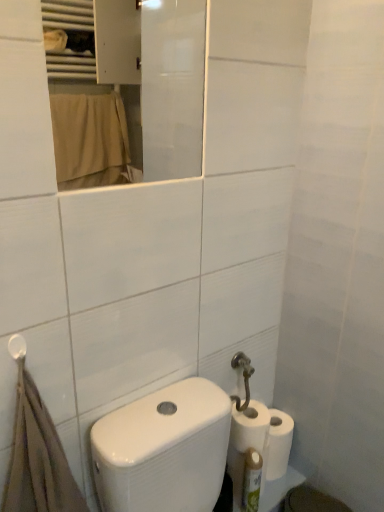
Question: Is white glossy mirror at upper center positioned beyond the bounds of white matte toilet paper at lower right, placed as the third toilet paper when sorted from top to bottom?

Choices:
 (A) no
 (B) yes

Answer: (B)

Question: From the image's perspective, would you say white glossy mirror at upper center is shown under white matte toilet paper at lower right, placed as the 1th toilet paper when sorted from bottom to top?

Choices:
 (A) yes
 (B) no

Answer: (B)

Question: Considering the relative positions of white glossy mirror at upper center and white matte toilet paper at lower right, placed as the 1th toilet paper when sorted from bottom to top, in the image provided, is white glossy mirror at upper center in front of white matte toilet paper at lower right, placed as the 1th toilet paper when sorted from bottom to top,?

Choices:
 (A) yes
 (B) no

Answer: (A)

Question: Is white glossy mirror at upper center wider than white matte toilet paper at lower right, placed as the third toilet paper when sorted from top to bottom?

Choices:
 (A) yes
 (B) no

Answer: (B)

Question: From a real-world perspective, is white glossy mirror at upper center under white matte toilet paper at lower right, placed as the 1th toilet paper when sorted from bottom to top?

Choices:
 (A) yes
 (B) no

Answer: (B)

Question: Does white glossy mirror at upper center have a larger size compared to white matte toilet paper at lower right, placed as the 1th toilet paper when sorted from bottom to top?

Choices:
 (A) yes
 (B) no

Answer: (A)

Question: Is white matte toilet paper at lower right, which is counted as the second toilet paper, starting from the top, aimed at white matte toilet paper at lower right, the third toilet paper when ordered from bottom to top?

Choices:
 (A) yes
 (B) no

Answer: (B)

Question: From the image's perspective, is white matte toilet paper at lower right, the 2th toilet paper positioned from the bottom, over white matte toilet paper at lower right, the third toilet paper when ordered from bottom to top?

Choices:
 (A) no
 (B) yes

Answer: (A)

Question: Is white matte toilet paper at lower right, the 2th toilet paper positioned from the bottom, located outside white matte toilet paper at lower right, which is counted as the first toilet paper, starting from the top?

Choices:
 (A) no
 (B) yes

Answer: (B)

Question: Is white matte toilet paper at lower right, which is counted as the second toilet paper, starting from the top, smaller than white matte toilet paper at lower right, which is counted as the first toilet paper, starting from the top?

Choices:
 (A) yes
 (B) no

Answer: (A)

Question: Is white matte toilet paper at lower right, the 2th toilet paper positioned from the bottom, positioned behind white matte toilet paper at lower right, which is counted as the first toilet paper, starting from the top?

Choices:
 (A) yes
 (B) no

Answer: (A)

Question: Is white matte toilet paper at lower right, which is counted as the second toilet paper, starting from the top, with white matte toilet paper at lower right, which is counted as the first toilet paper, starting from the top?

Choices:
 (A) no
 (B) yes

Answer: (B)

Question: From a real-world perspective, is white matte toilet paper at lower right, which is counted as the first toilet paper, starting from the top, physically below green plastic bottle at lower right?

Choices:
 (A) no
 (B) yes

Answer: (A)